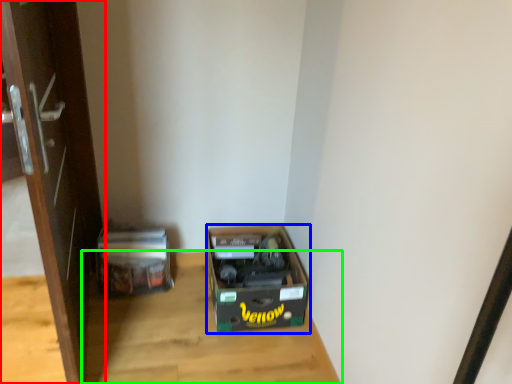
Question: Considering the real-world distances, which object is closest to door (highlighted by a red box)? box (highlighted by a blue box) or table (highlighted by a green box).

Choices:
 (A) box
 (B) table

Answer: (B)